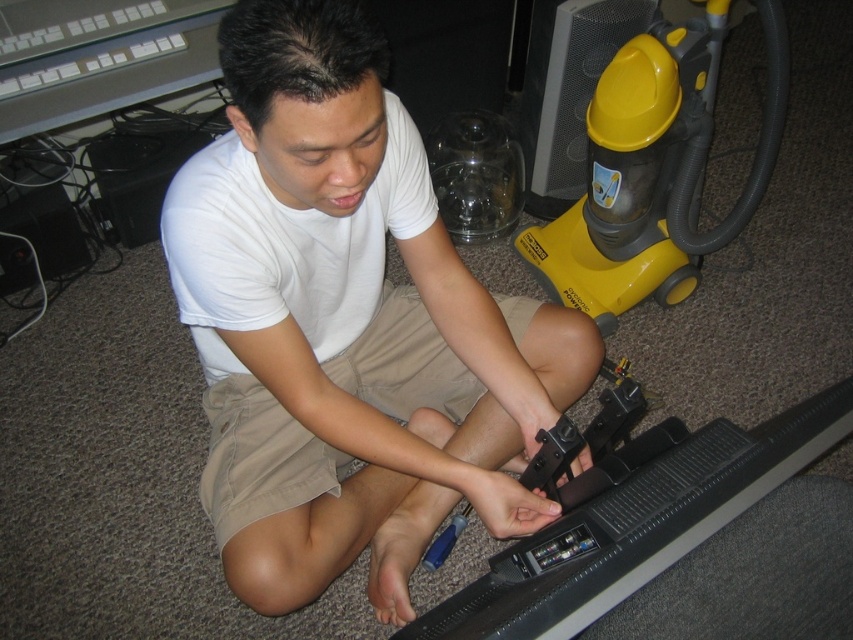
Consider the image. You are helping someone assemble a TV stand. The black plastic tv at lower center and the yellow plastic vacuum cleaner at right are both in the room. Which object is taller?

The yellow plastic vacuum cleaner at right is taller than the black plastic tv at lower center.

You are a delivery person who just arrived at a house to drop off a large package. You see a black plastic tv at lower center and khaki shorts at center. Which object is bigger?

The black plastic tv at lower center is larger in size compared to the khaki shorts at center.

Where is the white matte shirt at center located in the image?

The white matte shirt at center is located at point coordinates of [346,324].